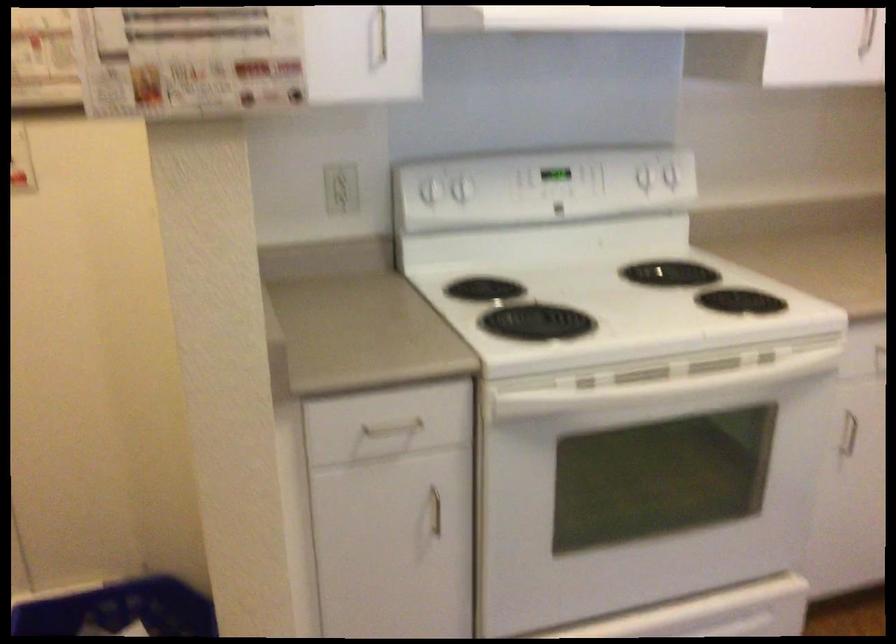
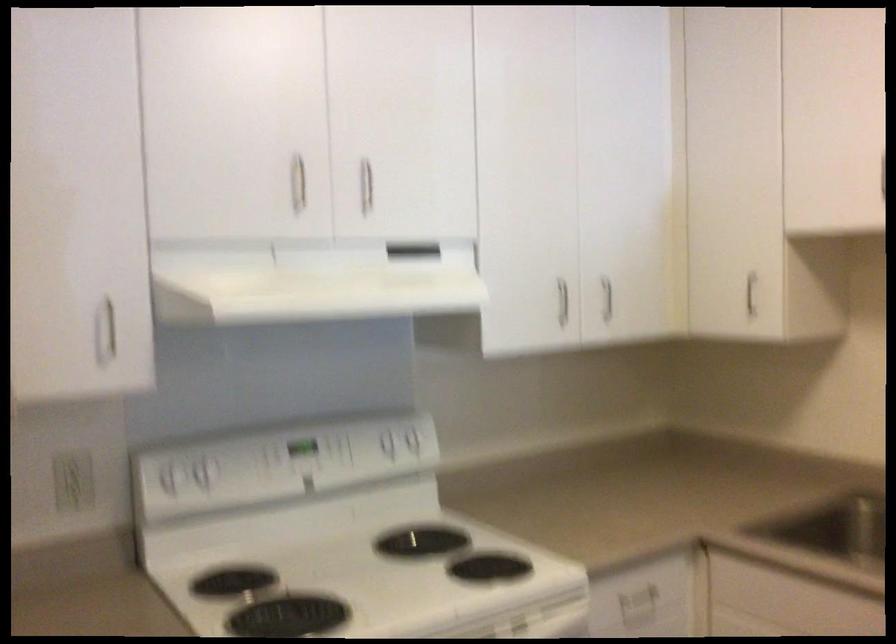
Find the pixel in the second image that matches (676,178) in the first image.

(419, 444)